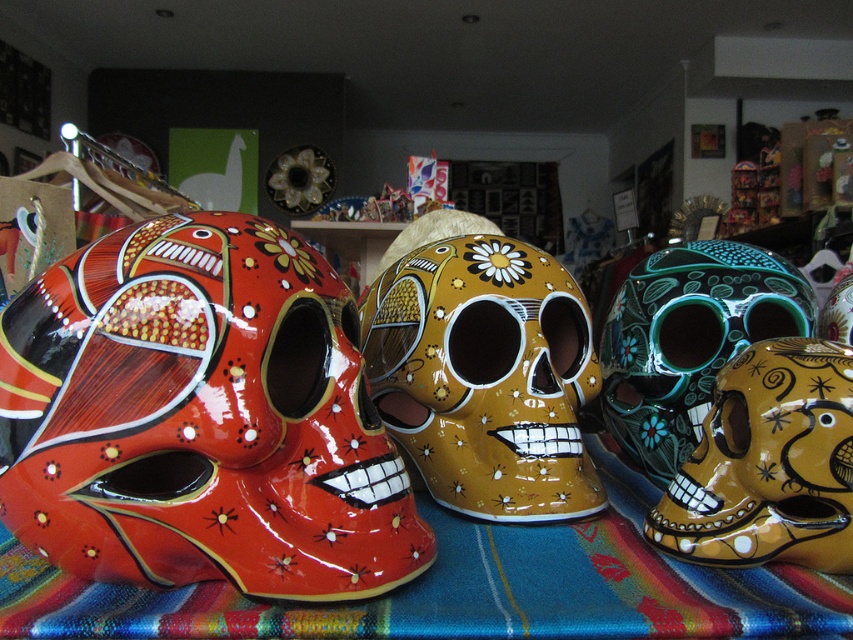
You are standing in a store and see a point marked at coordinates (466, 588). According to the scene, what surface is this point located on?

The point is located on the textured woven cloth at center.

You are an artist preparing to photograph the green glossy skull at center right and the textured woven cloth at center. Based on their positions, which object is closer to the right edge of the image?

The green glossy skull at center right is closer to the right edge of the image because the textured woven cloth at center is to its left.

You are a customer in a store looking at the vibrant display of colorful ceramic skull masks. You notice the glossy ceramic skull at left and the green glossy skull at center right. Which of these two skulls is located below the other?

The glossy ceramic skull at left is positioned under the green glossy skull at center right, meaning it is located below the green glossy skull at center right.